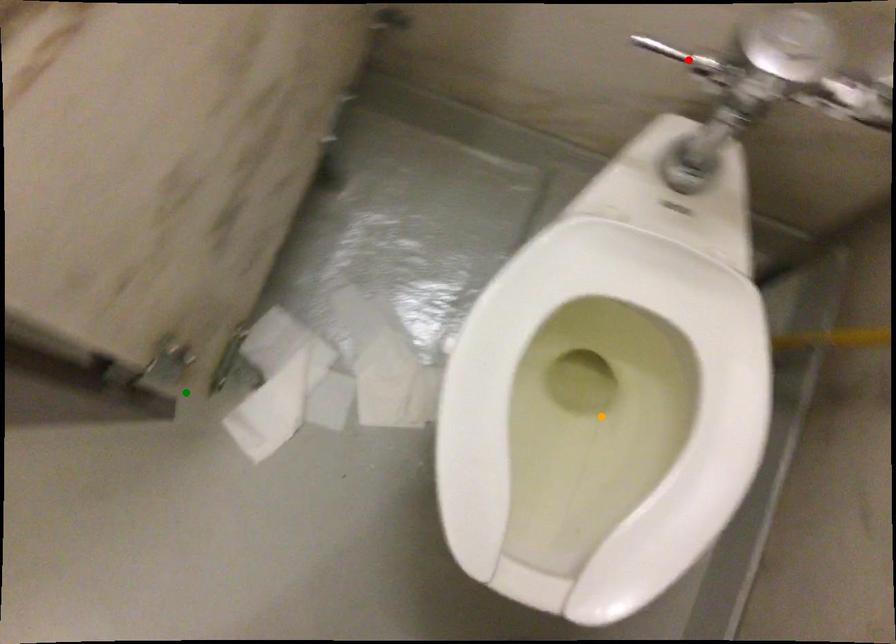
Order these from nearest to farthest:
- orange point
- green point
- red point

red point
orange point
green point